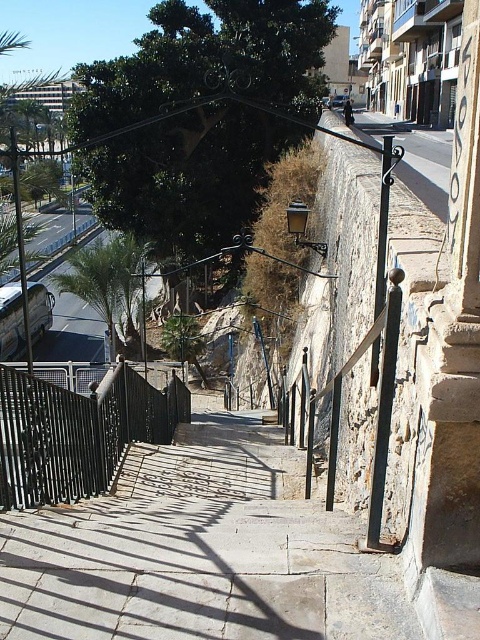
Question: Is smooth stone steps at center above green leafy palm tree at left?

Choices:
 (A) no
 (B) yes

Answer: (A)

Question: Based on their relative distances, which object is farther from the green leafy palm tree at left?

Choices:
 (A) black wrought iron railing at center
 (B) smooth stone steps at center

Answer: (B)

Question: Which of the following is the closest to the observer?

Choices:
 (A) click(x=132, y=397)
 (B) click(x=116, y=280)
 (C) click(x=367, y=592)

Answer: (C)

Question: Does smooth stone steps at center come in front of green leafy palm tree at left?

Choices:
 (A) no
 (B) yes

Answer: (B)

Question: Is black wrought iron railing at center bigger than green leafy palm tree at left?

Choices:
 (A) yes
 (B) no

Answer: (B)

Question: Based on their relative distances, which object is farther from the black wrought iron railing at center?

Choices:
 (A) green leafy palm tree at left
 (B) smooth stone steps at center

Answer: (A)